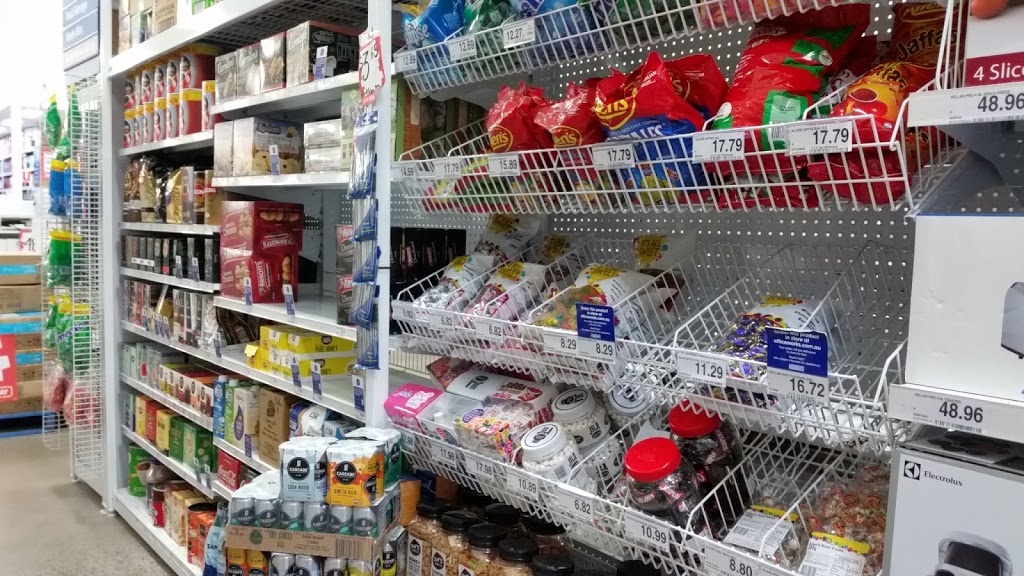
Locate an element on the screen. Image resolution: width=1024 pixels, height=576 pixels. basket shelf is located at coordinates (477, 63), (492, 189), (509, 332), (512, 471).